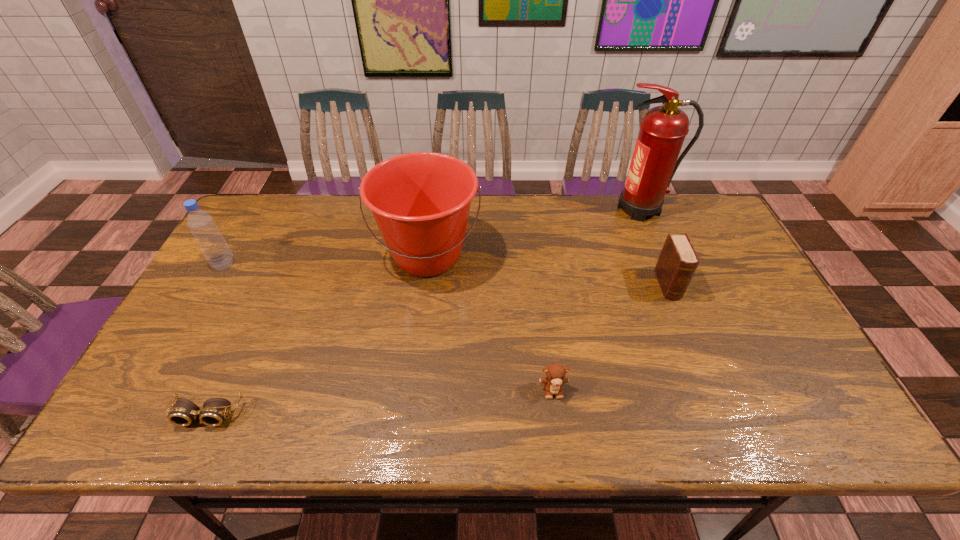
You are a GUI agent. You are given a task and a screenshot of the screen. Output one action in this format:
    pyautogui.click(x=<x>, y=<y>)
    Task: Click on the tallest object
    
    Given the screenshot: What is the action you would take?
    pyautogui.click(x=663, y=129)

Where is `the farthest object`? The height and width of the screenshot is (540, 960). the farthest object is located at coordinates (663, 129).

Locate an element on the screen. bucket is located at coordinates (421, 201).

Identify the location of the leftmost object. This screenshot has height=540, width=960. (201, 224).

At what (x,y) coordinates should I click in order to perform the action: click on the third tallest object. Please return your answer as a coordinate pair (x, y). Looking at the image, I should click on (201, 224).

Find the location of a particular element. The width and height of the screenshot is (960, 540). the fourth tallest object is located at coordinates (678, 260).

Locate an element on the screen. The width and height of the screenshot is (960, 540). the fourth object from left to right is located at coordinates (555, 373).

In order to click on the fifth tallest object in this screenshot , I will do `click(555, 373)`.

I want to click on the shortest object, so click(x=183, y=413).

Image resolution: width=960 pixels, height=540 pixels. What are the coordinates of `goggles` in the screenshot? It's located at (183, 413).